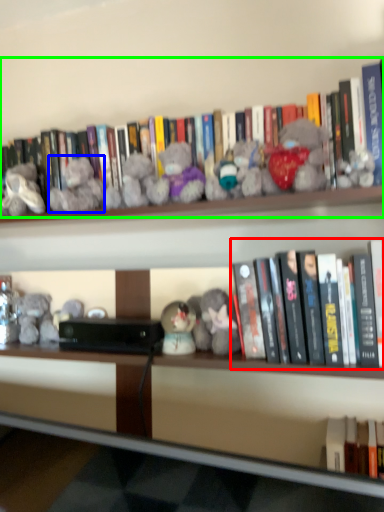
Question: Based on their relative distances, which object is farther from book (highlighted by a red box)? Choose from toy (highlighted by a blue box) and book (highlighted by a green box).

Choices:
 (A) toy
 (B) book

Answer: (A)